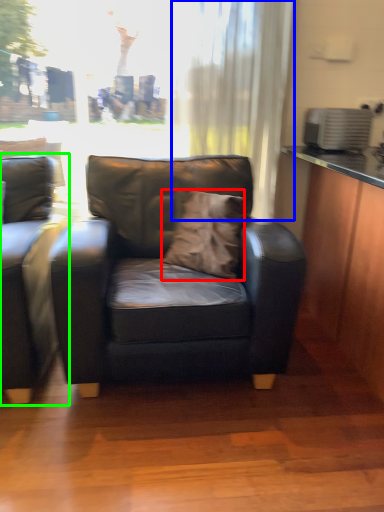
Question: Which object is positioned farthest from pillow (highlighted by a red box)? Select from curtain (highlighted by a blue box) and studio couch (highlighted by a green box).

Choices:
 (A) curtain
 (B) studio couch

Answer: (A)